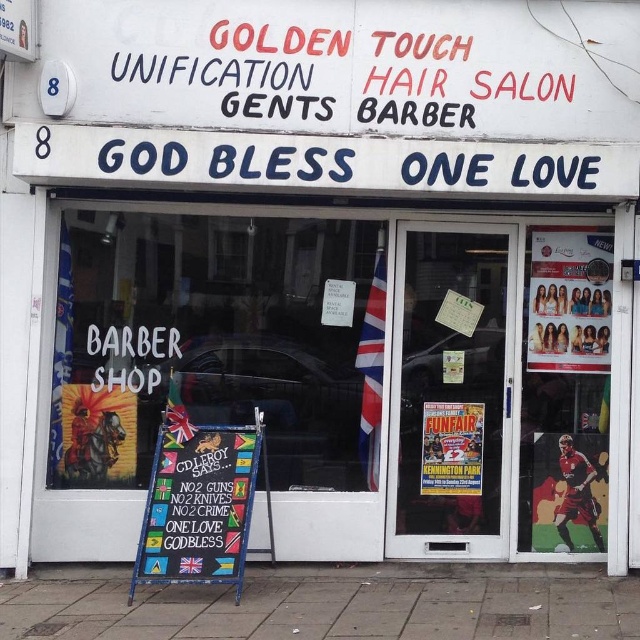
Which is behind, point (397, 508) or point (564, 493)?

Point (397, 508)

Consider the image. Can you confirm if transparent glass door at center is shorter than red fabric soccer player at lower right?

No.

Does point (468, 490) come farther from viewer compared to point (547, 520)?

Yes, point (468, 490) is farther from viewer.

The height and width of the screenshot is (640, 640). Find the location of `transparent glass door at center`. transparent glass door at center is located at coordinates (451, 381).

Which of these two, transparent glass barber shop sign at center or red fabric soccer player at lower right, stands taller?

With more height is transparent glass barber shop sign at center.

From the picture: Who is more distant from viewer, [280,241] or [600,470]?

The point [280,241] is behind.

Who is more forward, (369, 326) or (560, 461)?

Positioned in front is point (560, 461).

I want to click on transparent glass barber shop sign at center, so click(218, 340).

Can you confirm if wooden signboard at center is shorter than paper poster at center?

No, wooden signboard at center is not shorter than paper poster at center.

This screenshot has width=640, height=640. What are the coordinates of `wooden signboard at center` in the screenshot? It's located at (198, 506).

Find the location of a particular element. wooden signboard at center is located at coordinates (198, 506).